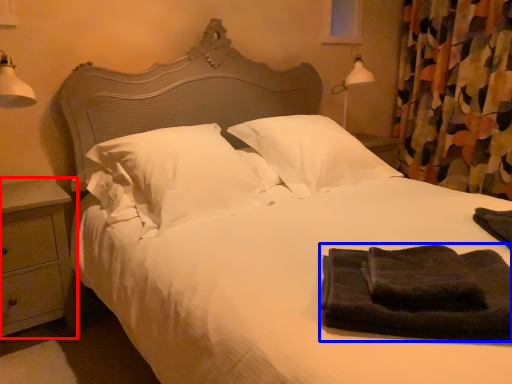
Question: Which point is further to the camera, nightstand (highlighted by a red box) or material (highlighted by a blue box)?

Choices:
 (A) nightstand
 (B) material

Answer: (A)